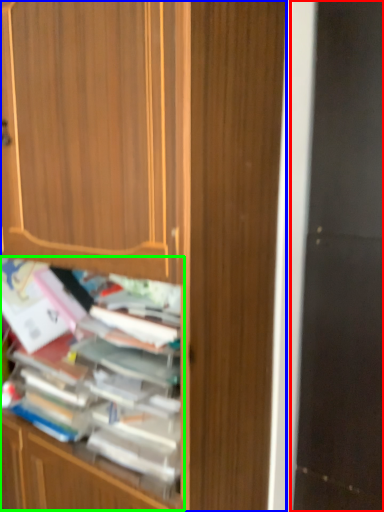
Question: Estimate the real-world distances between objects in this image. Which object is farther from screen door (highlighted by a red box), cabinetry (highlighted by a blue box) or shelf (highlighted by a green box)?

Choices:
 (A) cabinetry
 (B) shelf

Answer: (B)